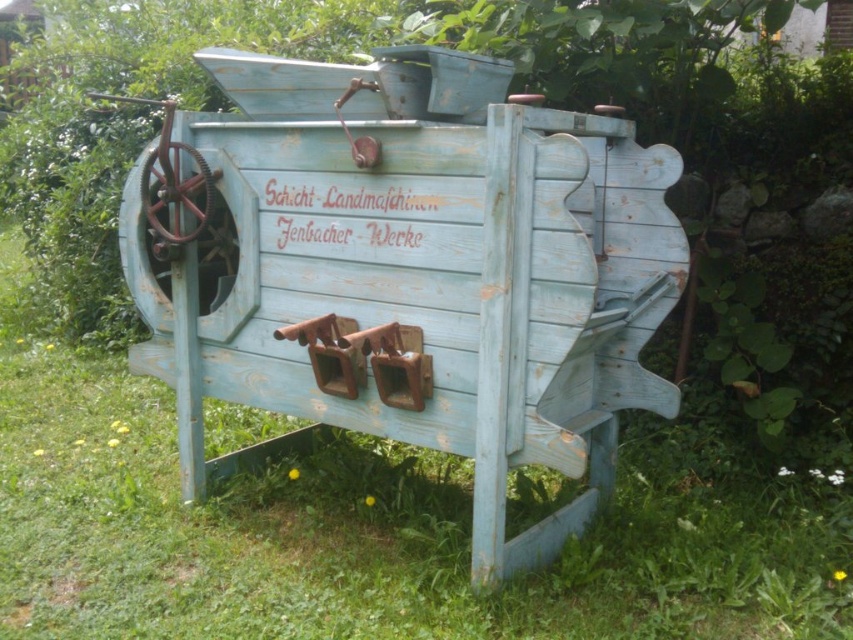
Question: Which point is farther from the camera taking this photo?

Choices:
 (A) (670, 435)
 (B) (225, 208)

Answer: (A)

Question: Considering the relative positions of distressed blue wood wagon at center and green grass at lower center in the image provided, where is distressed blue wood wagon at center located with respect to green grass at lower center?

Choices:
 (A) right
 (B) left

Answer: (A)

Question: Does distressed blue wood wagon at center appear on the right side of green grass at lower center?

Choices:
 (A) no
 (B) yes

Answer: (B)

Question: Is distressed blue wood wagon at center wider than green grass at lower center?

Choices:
 (A) yes
 (B) no

Answer: (B)

Question: Which point is closer to the camera?

Choices:
 (A) green grass at lower center
 (B) distressed blue wood wagon at center

Answer: (B)